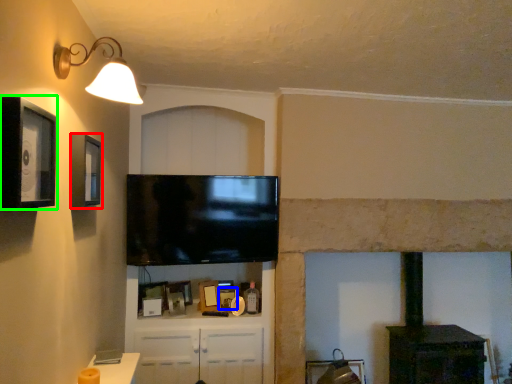
Question: Which object is the closest to the picture frame (highlighted by a red box)? Choose among these: picture frame (highlighted by a blue box) or picture frame (highlighted by a green box).

Choices:
 (A) picture frame
 (B) picture frame

Answer: (B)